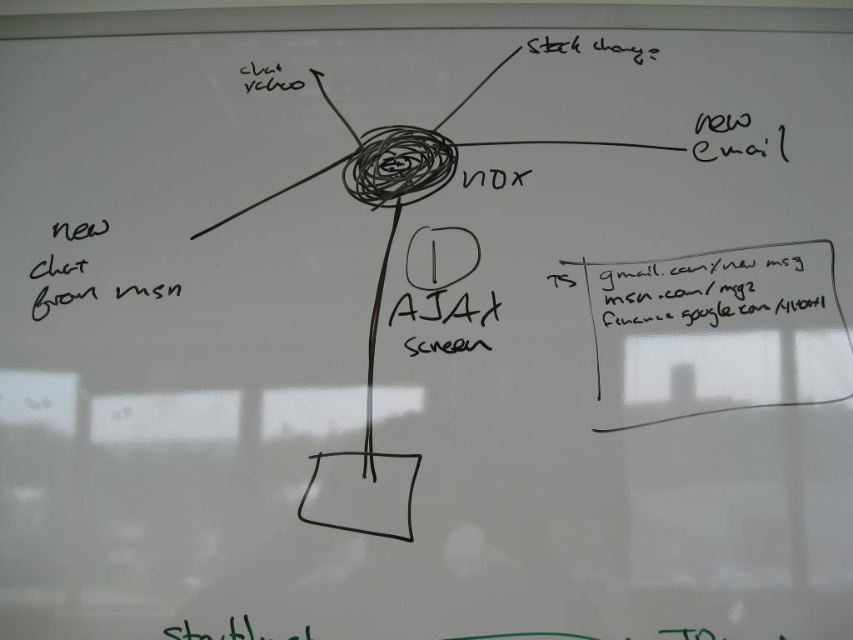
You are an assistant trying to locate the black text at upper right and the black handwritten text at lower left on the whiteboard. Which one is positioned more to the east side of the whiteboard?

The black text at upper right is positioned more to the east side of the whiteboard because it is to the right of the black handwritten text at lower left.

You are an assistant who needs to locate the shortest text on the whiteboard. Which one is it between the black text at upper right and the black handwritten text at lower left?

The black text at upper right is shorter than the black handwritten text at lower left, so the shortest text is the black text at upper right.